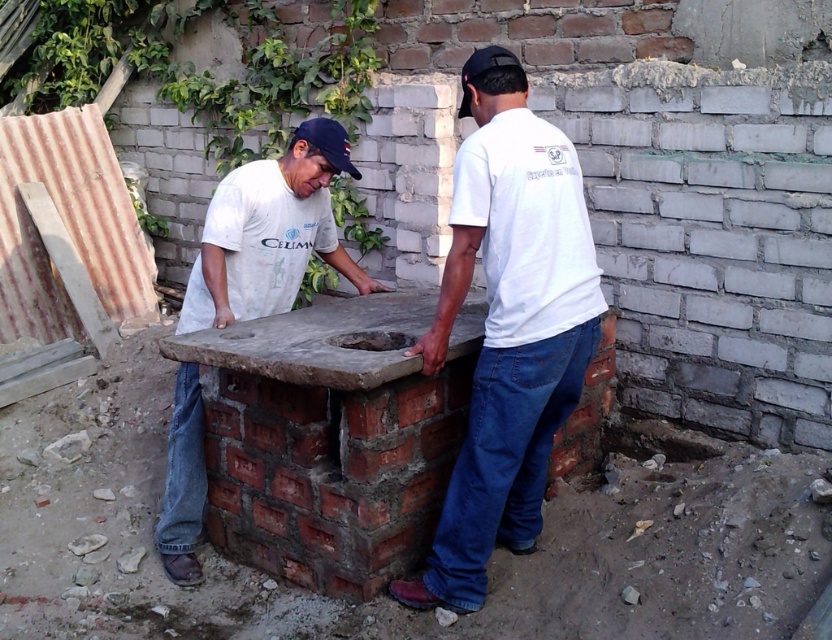
Question: Considering the real-world distances, which object is farthest from the white cotton shirt at center?

Choices:
 (A) black fabric baseball cap at upper center
 (B) matte concrete oven at center

Answer: (B)

Question: Among these points, which one is farthest from the camera?

Choices:
 (A) (317, 156)
 (B) (339, 129)

Answer: (B)

Question: Estimate the real-world distances between objects in this image. Which object is closer to the black fabric baseball cap at upper center?

Choices:
 (A) matte concrete oven at center
 (B) white cotton shirt at center

Answer: (A)

Question: Does white cotton shirt at center appear over black fabric baseball cap at upper center?

Choices:
 (A) yes
 (B) no

Answer: (B)

Question: Is white cotton shirt at center bigger than matte concrete oven at center?

Choices:
 (A) no
 (B) yes

Answer: (A)

Question: Is the position of white cotton shirt at center less distant than that of black fabric baseball cap at upper center?

Choices:
 (A) no
 (B) yes

Answer: (B)